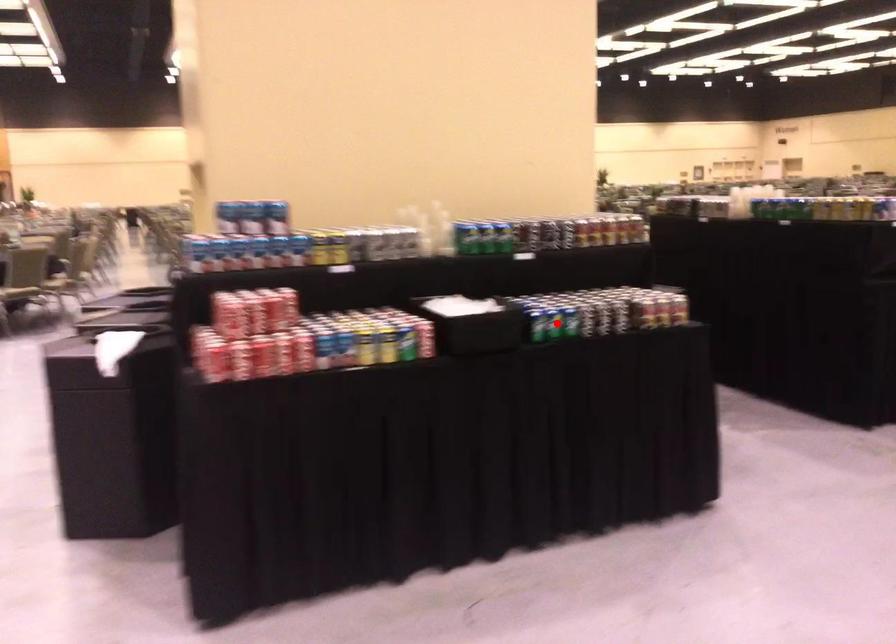
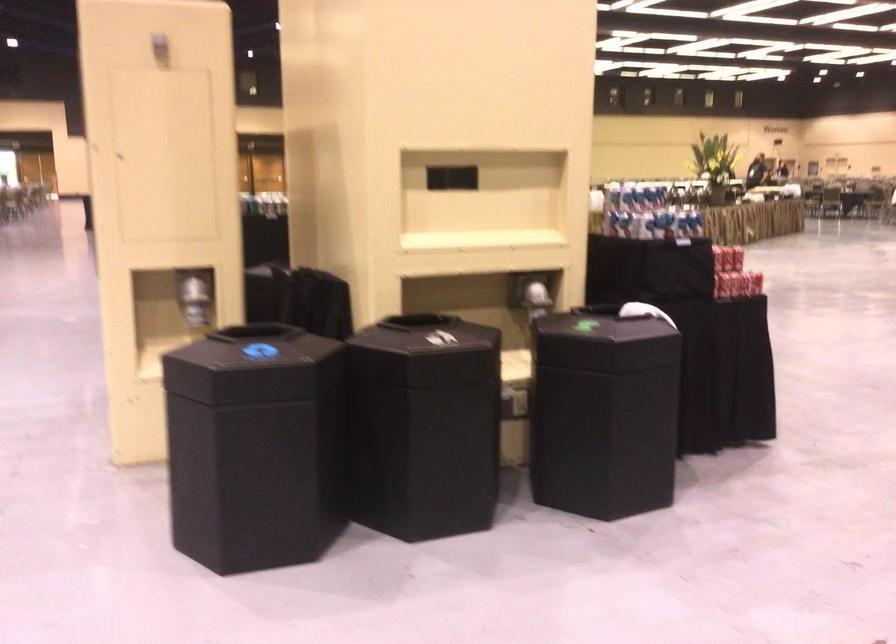
Question: I am providing you with two images of the same scene from different viewpoints. A red point is marked on the first image. At the location where the point appears in image 1, is it still visible in image 2?

Choices:
 (A) Yes
 (B) No

Answer: (B)